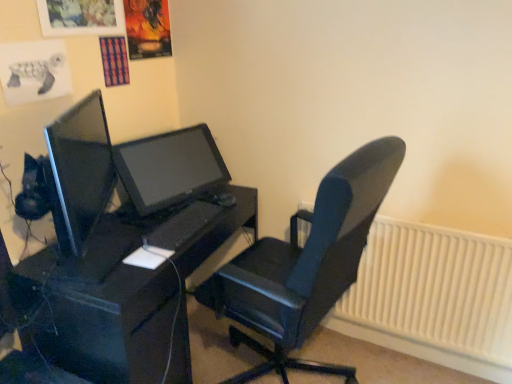
Find the location of a particular element. This screenshot has height=384, width=512. free region under black matte keyboard at center (from a real-world perspective) is located at coordinates (179, 223).